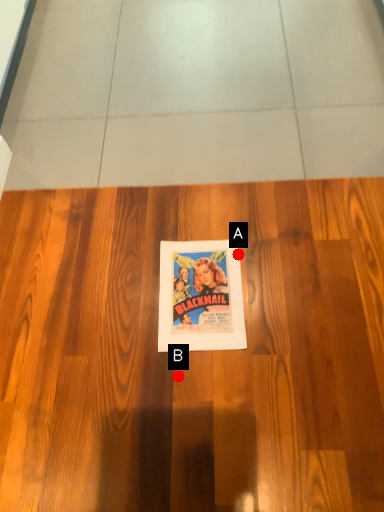
Question: Two points are circled on the image, labeled by A and B beside each circle. Which point is further to the camera?

Choices:
 (A) A is further
 (B) B is further

Answer: (A)